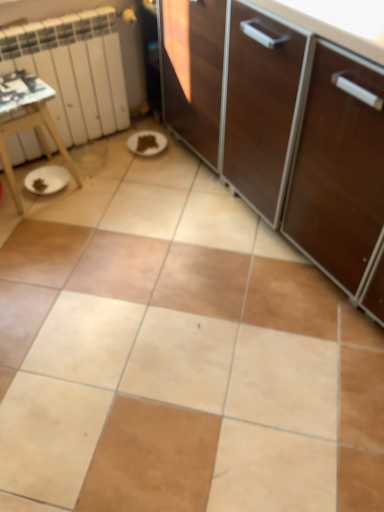
Locate an element on the screen. vacant area in front of white wooden table at left is located at coordinates (40, 227).